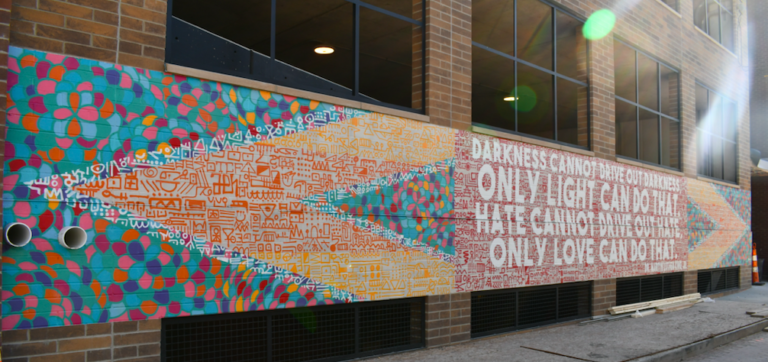
Where is `right light`? The height and width of the screenshot is (362, 768). right light is located at coordinates [505, 99].